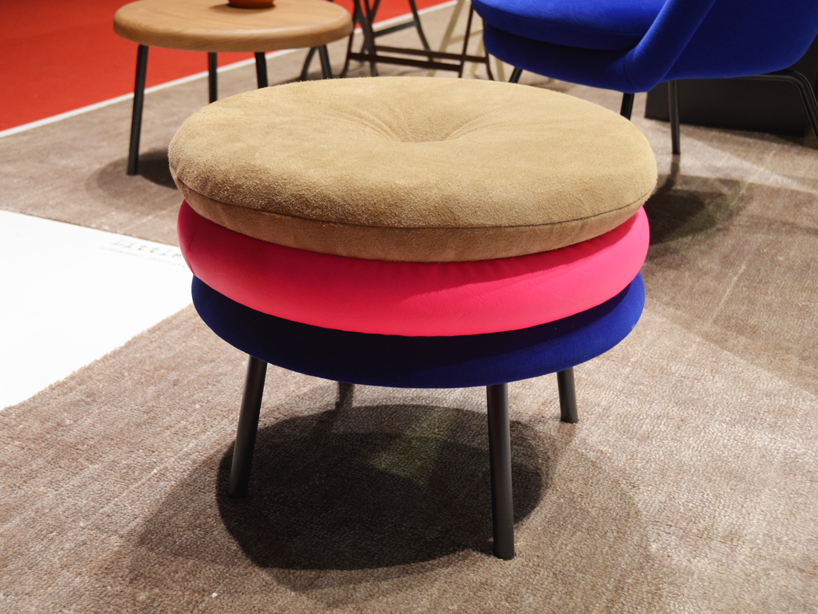
I want to click on stool leg, so click(x=562, y=398).